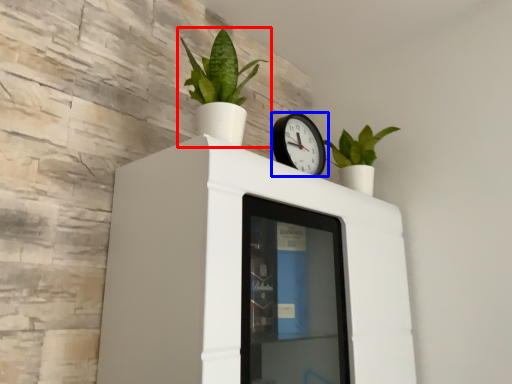
Question: Among these objects, which one is nearest to the camera, houseplant (highlighted by a red box) or wall clock (highlighted by a blue box)?

Choices:
 (A) houseplant
 (B) wall clock

Answer: (A)